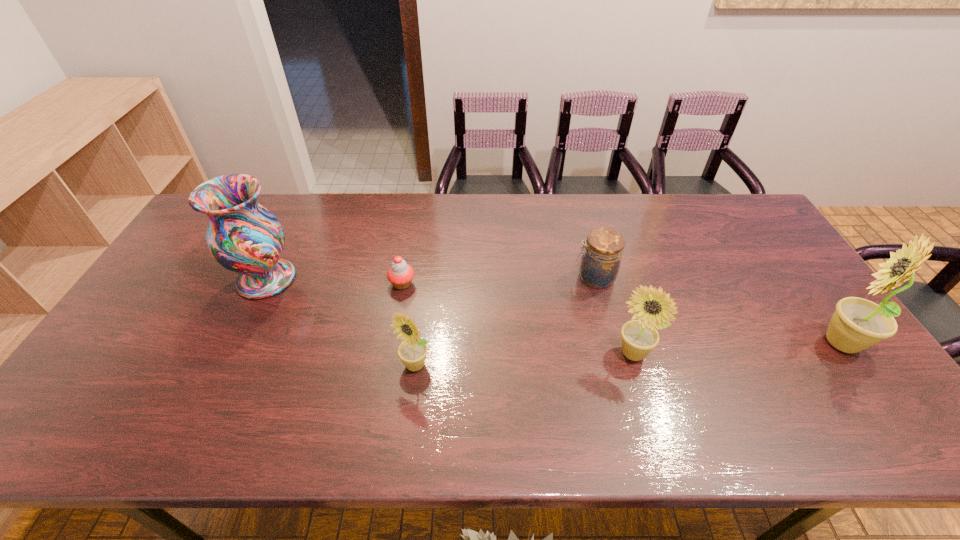
Where is `vacant space at the far edge of the desktop`? vacant space at the far edge of the desktop is located at coordinates (435, 227).

Locate an element on the screen. Image resolution: width=960 pixels, height=540 pixels. vacant space at the near edge is located at coordinates (336, 390).

The image size is (960, 540). I want to click on free space at the left edge of the desktop, so click(136, 312).

The width and height of the screenshot is (960, 540). Identify the location of vacant region at the near left corner of the desktop. (86, 392).

At what (x,y) coordinates should I click in order to perform the action: click on free area in between the leftmost sunflower and the jar. Please return your answer as a coordinate pair (x, y). Looking at the image, I should click on (505, 321).

The height and width of the screenshot is (540, 960). In order to click on vacant area that lies between the leftmost object and the leftmost sunflower in this screenshot , I will do `click(340, 322)`.

Locate an element on the screen. Image resolution: width=960 pixels, height=540 pixels. free space between the vase and the tallest sunflower is located at coordinates (553, 310).

I want to click on vacant region between the rightmost sunflower and the leftmost object, so click(x=553, y=310).

Image resolution: width=960 pixels, height=540 pixels. In order to click on empty space that is in between the second sunflower from right to left and the fifth tallest object in this screenshot , I will do point(613,315).

The height and width of the screenshot is (540, 960). Identify the location of free space between the leftmost object and the second sunflower from right to left. (449, 316).